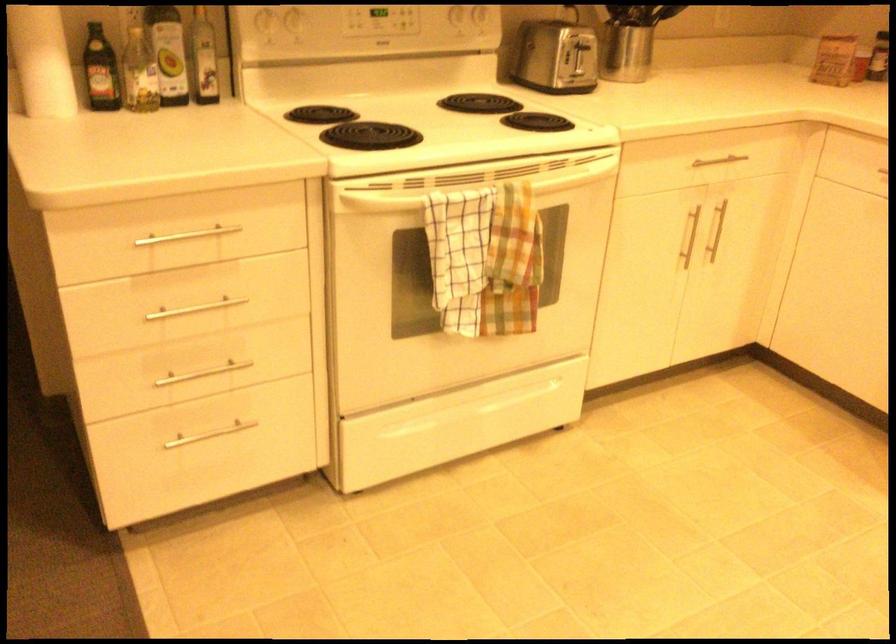
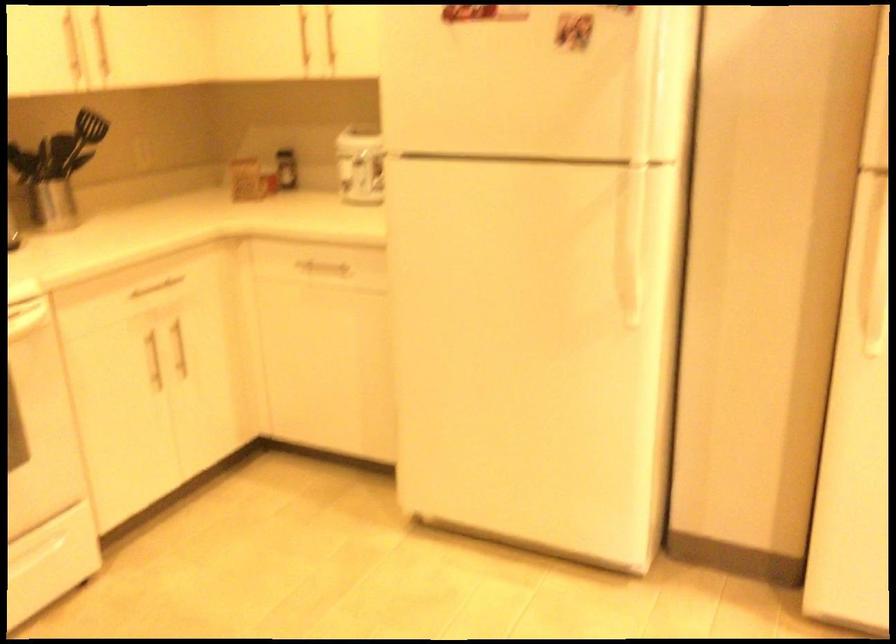
The point at (536, 388) is marked in the first image. Where is the corresponding point in the second image?

(37, 553)